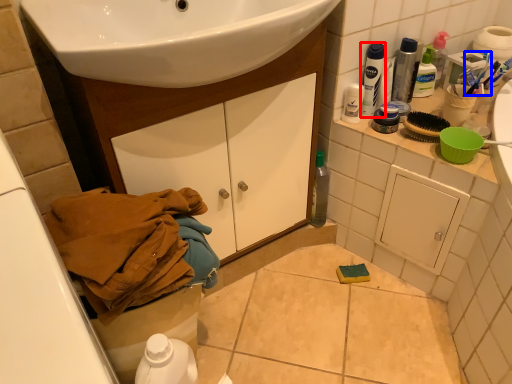
Question: Among these objects, which one is farthest to the camera, mouthwash (highlighted by a red box) or toothbrush (highlighted by a blue box)?

Choices:
 (A) mouthwash
 (B) toothbrush

Answer: (B)